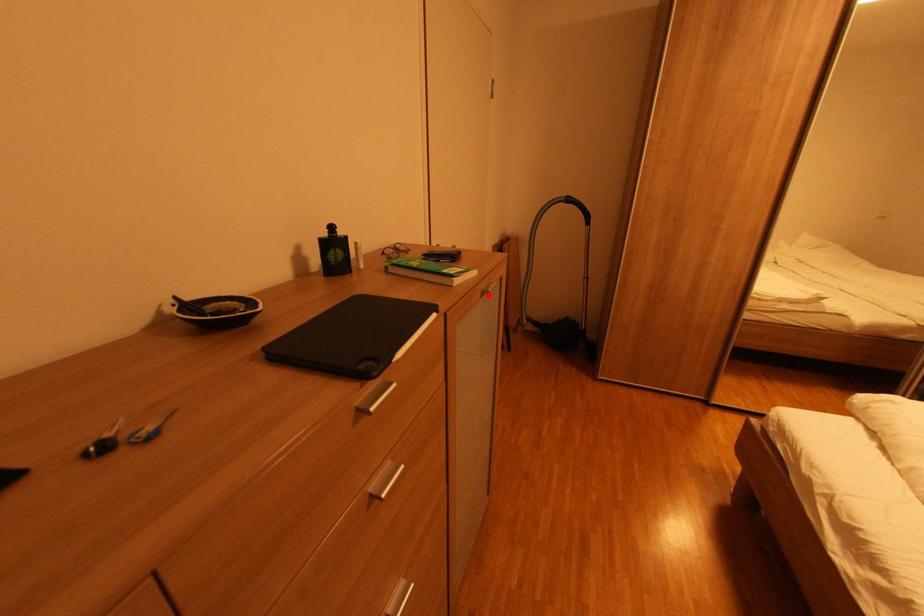
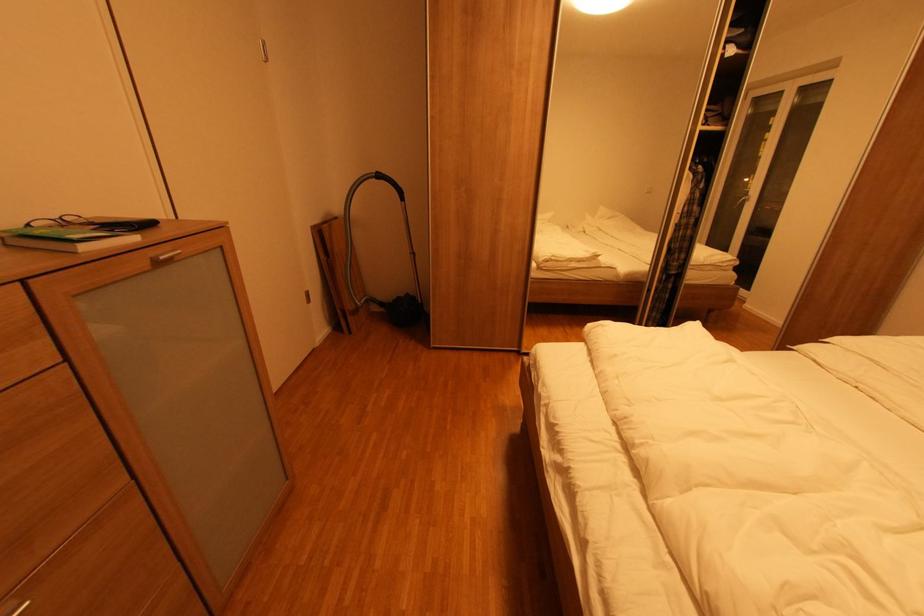
The point at the highlighted location is marked in the first image. Where is the corresponding point in the second image?

(164, 264)